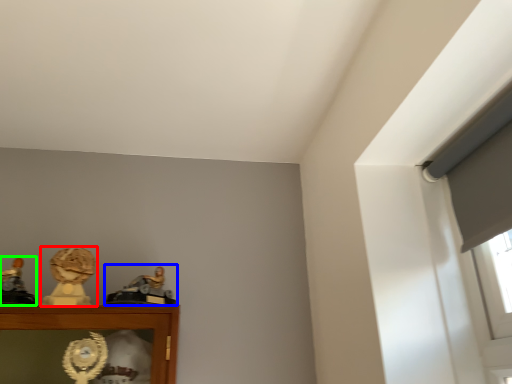
Question: Which is farther away from character sculpture (highlighted by a red box)? character sculpture (highlighted by a blue box) or character sculpture (highlighted by a green box)?

Choices:
 (A) character sculpture
 (B) character sculpture

Answer: (B)